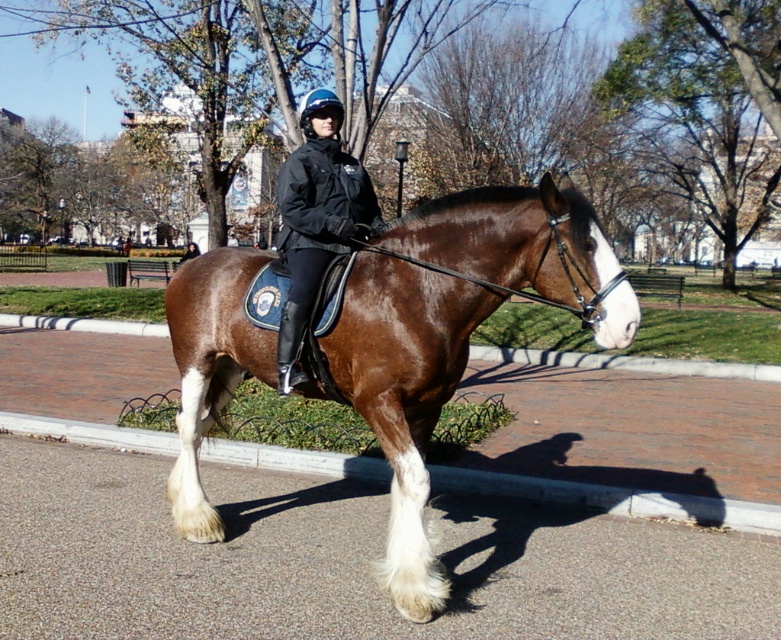
You are a photographer standing in the park and want to take a photo of the mounted police officer. You notice the brown glossy horse at center and the black leather jacket at center. Which object is located to the right of the other?

The brown glossy horse at center is positioned on the right side of black leather jacket at center, so the horse is to the right of the jacket.

You are a photographer standing at a certain position. You want to take a photo of the brown glossy horse at center. Your camera has a focal length of 50mm and you want to capture the horse in the frame without moving the camera. What is the minimum distance you need to be from the horse to ensure it fits in the frame?

The minimum distance required to ensure the brown glossy horse at center fits in the frame is 3.16 meters.

You are a photographer trying to capture a clear shot of the mounted police officer in the park. You notice the brown glossy horse at center and the black leather jacket at center. Which object should you focus on first if you want to ensure both are in the frame without moving the camera?

The brown glossy horse at center is larger in size than the black leather jacket at center, so focusing on the horse first will help ensure both are in the frame since it occupies more space.